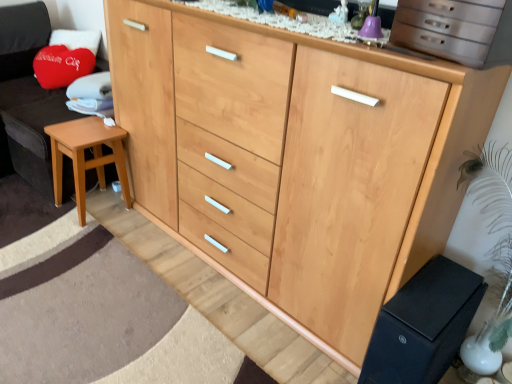
I want to click on vacant region above black matte changing table at lower right (from a real-world perspective), so click(x=434, y=291).